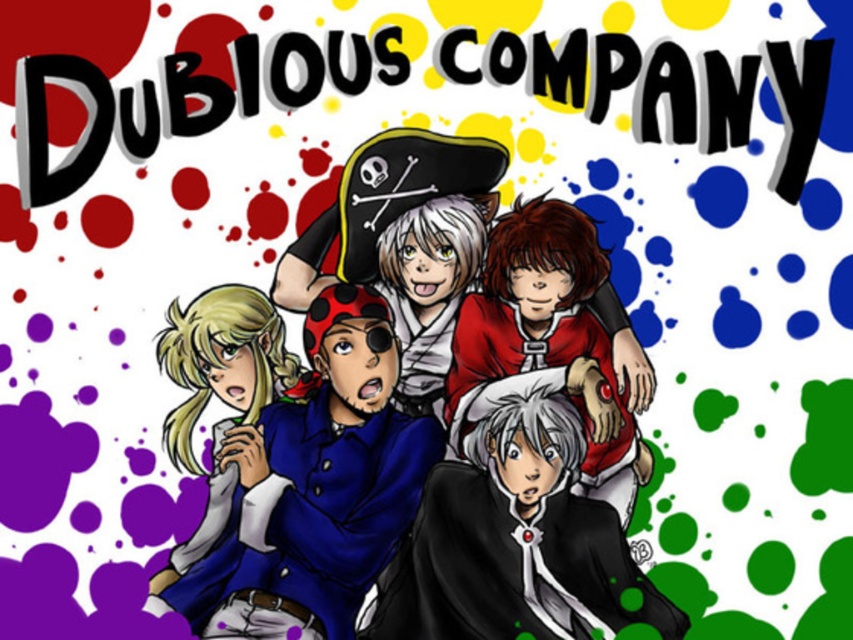
Question: Can you confirm if smooth black coat at center is bigger than smooth red shirt at center?

Choices:
 (A) no
 (B) yes

Answer: (B)

Question: Is blue fabric shirt at center in front of satin blue dress at lower left?

Choices:
 (A) yes
 (B) no

Answer: (B)

Question: Estimate the real-world distances between objects in this image. Which object is closer to the blue fabric shirt at center?

Choices:
 (A) satin blue dress at lower left
 (B) smooth black coat at center
 (C) smooth blue shirt at center
 (D) smooth red shirt at center

Answer: (C)

Question: Is the position of blue fabric shirt at center more distant than that of smooth black coat at center?

Choices:
 (A) no
 (B) yes

Answer: (A)

Question: Which point appears closest to the camera in this image?

Choices:
 (A) (247, 298)
 (B) (585, 376)

Answer: (A)

Question: Which point is closer to the camera taking this photo?

Choices:
 (A) (494, 520)
 (B) (199, 397)
 (C) (566, 209)
 (D) (189, 618)

Answer: (D)